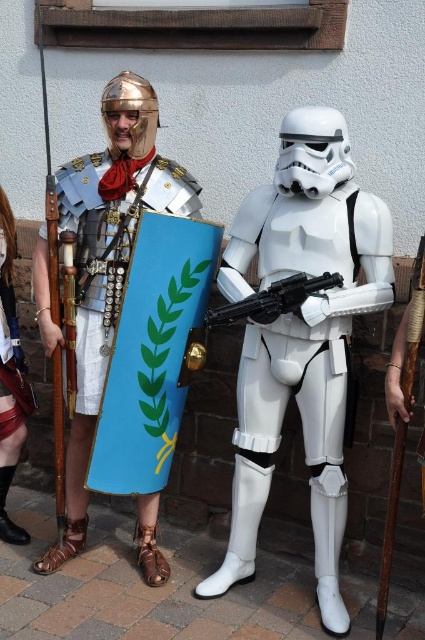
You are organizing a costume parade and need to arrange the white plastic stormtrooper at center and the metallic armor at left in a line. If you want the taller costume to be at the front, which one should you place first?

The white plastic stormtrooper at center is larger than the metallic armor at left, so you should place the white plastic stormtrooper at center first at the front of the line.

You are a photographer trying to capture a photo of both the Roman soldier and the Stormtrooper. You notice two points marked in the image. The first point is at coordinate point (337, 401) and the second is at point (223, 316). Which point is closer to the front of the scene?

Point (223, 316) is closer to the front of the scene because point (337, 401) is behind it.

You are a photographer trying to capture a photo of the shiny red skirt at lower left and the black plastic blaster at center. To ensure both are in frame, you need to know their relative positions. Which object is located to the left of the other?

The shiny red skirt at lower left is positioned on the left side of black plastic blaster at center, so the shiny red skirt at lower left is to the left of the black plastic blaster at center.